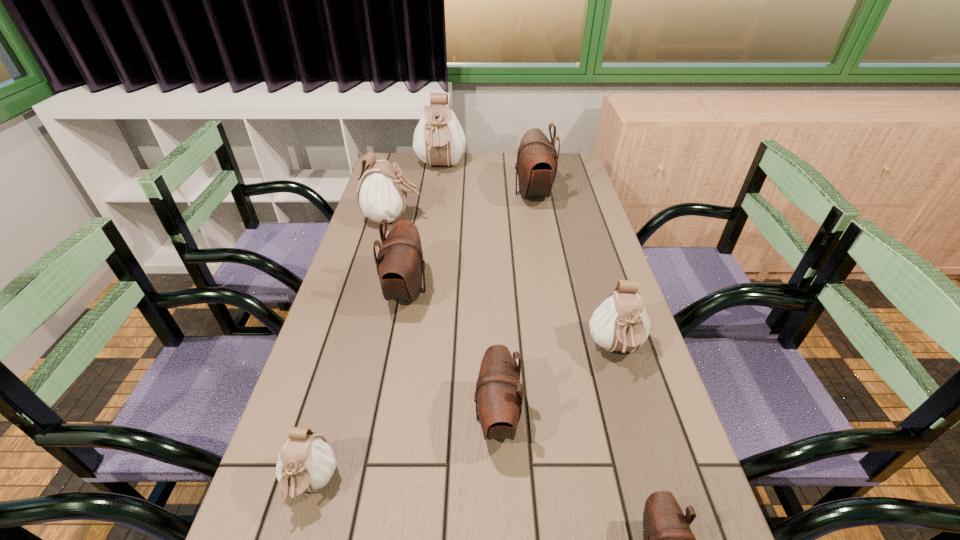
Where is `vacant space that satisfies the following two spatial constraints: 1. on the front-facing side of the biggest white pouch; 2. on the front-facing side of the third nearest white pouch`? vacant space that satisfies the following two spatial constraints: 1. on the front-facing side of the biggest white pouch; 2. on the front-facing side of the third nearest white pouch is located at coordinates (433, 219).